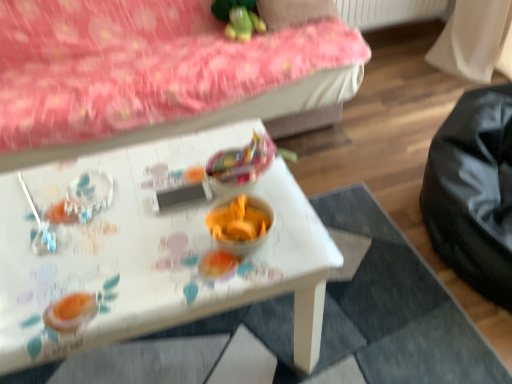
Where is `vacant space behind shiny plastic candy at center`? Image resolution: width=512 pixels, height=384 pixels. vacant space behind shiny plastic candy at center is located at coordinates (204, 140).